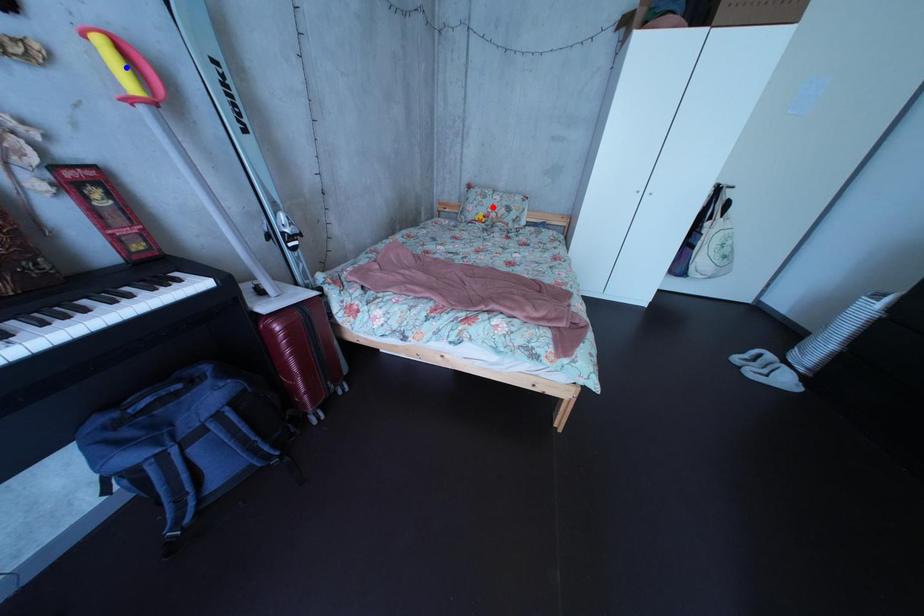
Question: Two points are marked on the image. Which point is closer to the camera?

Choices:
 (A) Blue point is closer.
 (B) Red point is closer.

Answer: (A)